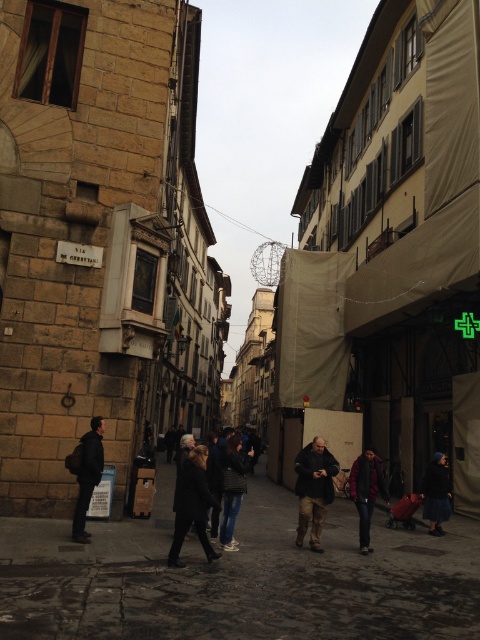
Question: Is dark gray coat at center bigger than dark gray backpack at left?

Choices:
 (A) yes
 (B) no

Answer: (A)

Question: Which object is the farthest from the dark gray stone alley at center?

Choices:
 (A) dark blue fabric coat at lower right
 (B) dark brown leather jacket at center

Answer: (A)

Question: Is dark red jacket at center bigger than dark blue fabric coat at lower right?

Choices:
 (A) yes
 (B) no

Answer: (B)

Question: Can you confirm if dark gray stone alley at center is thinner than dark gray coat at center?

Choices:
 (A) no
 (B) yes

Answer: (A)

Question: Which object is positioned farthest from the dark gray backpack at left?

Choices:
 (A) dark gray fabric coat at center
 (B) dark gray coat at center

Answer: (A)

Question: Which of the following is the farthest from the observer?

Choices:
 (A) (204, 477)
 (B) (237, 454)
 (C) (391, 545)

Answer: (C)